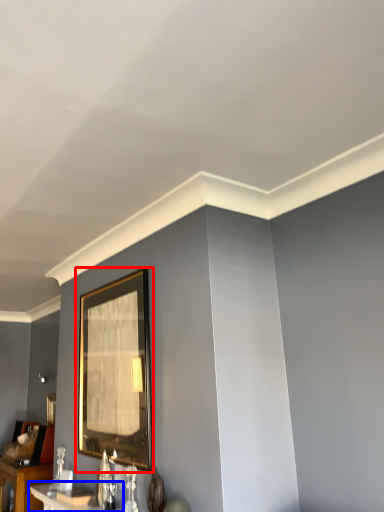
Question: Which point is further to the camera, picture frame (highlighted by a red box) or table (highlighted by a blue box)?

Choices:
 (A) picture frame
 (B) table

Answer: (A)